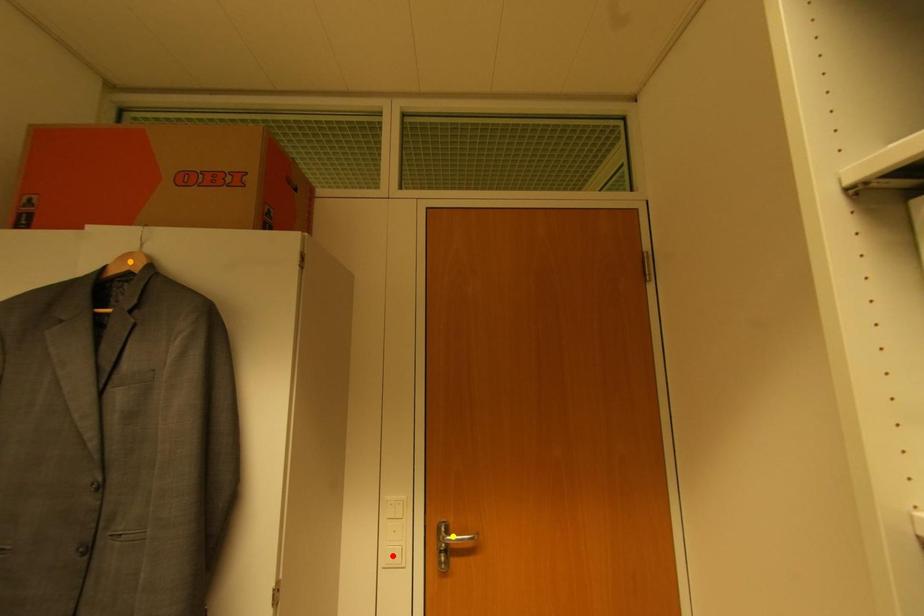
Order these from nearest to farthest:
A) yellow point
B) orange point
C) red point

1. yellow point
2. red point
3. orange point